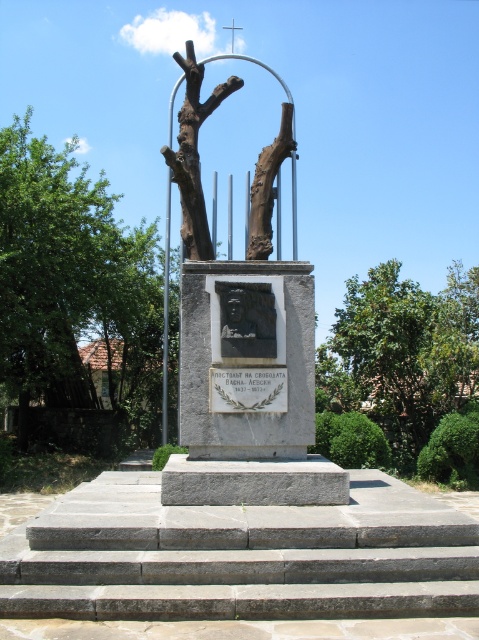
Question: Is brown rough bark at left below black stone relief at center?

Choices:
 (A) no
 (B) yes

Answer: (A)

Question: Where is brown rough bark at left located in relation to matte stone portrait at center in the image?

Choices:
 (A) below
 (B) above

Answer: (B)

Question: Considering the real-world distances, which object is farthest from the green leafy tree at center?

Choices:
 (A) matte stone portrait at center
 (B) white stone plaque at center
 (C) black stone relief at center
 (D) brown rough bark at left

Answer: (A)

Question: Does brown rough bark at left lie in front of rustic stone sculpture at center?

Choices:
 (A) yes
 (B) no

Answer: (B)

Question: Among these objects, which one is nearest to the camera?

Choices:
 (A) brown rough bark at left
 (B) white stone plaque at center

Answer: (B)

Question: Based on their relative distances, which object is nearer to the white stone plaque at center?

Choices:
 (A) brown rough bark at left
 (B) rustic stone sculpture at center
 (C) green leafy tree at center

Answer: (B)